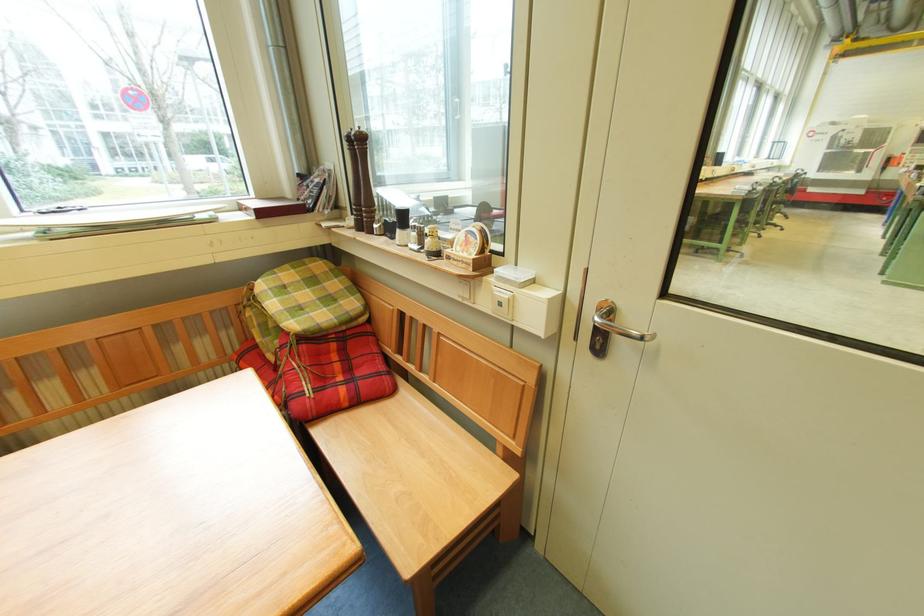
The location [402,217] corresponds to which object?

It refers to a black pepper shaker.